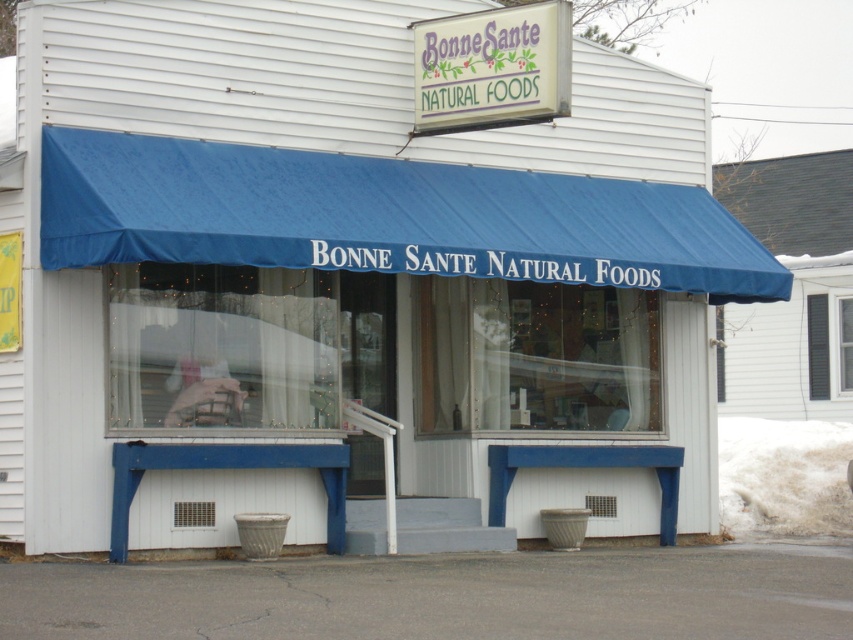
Is transparent plastic window at center bigger than black wood window at upper right?

Yes.

Who is lower down, transparent plastic window at center or black wood window at upper right?

Positioned lower is black wood window at upper right.

Who is more distant from viewer, (294, 289) or (819, 397)?

The point (819, 397) is more distant.

At what (x,y) coordinates should I click in order to perform the action: click on transparent plastic window at center. Please return your answer as a coordinate pair (x, y). Looking at the image, I should click on (247, 346).

Is blue fabric canopy at center to the right of black wood window at upper right from the viewer's perspective?

Incorrect, blue fabric canopy at center is not on the right side of black wood window at upper right.

Can you confirm if blue fabric canopy at center is taller than black wood window at upper right?

Incorrect, blue fabric canopy at center's height is not larger of black wood window at upper right's.

Is point (155, 221) more distant than point (846, 390)?

That is False.

Locate an element on the screen. blue fabric canopy at center is located at coordinates (384, 218).

Who is positioned more to the left, transparent plastic window at center or matte plastic sign at upper center?

transparent plastic window at center is more to the left.

Who is shorter, transparent plastic window at center or matte plastic sign at upper center?

matte plastic sign at upper center

Where is `transparent plastic window at center`? This screenshot has width=853, height=640. transparent plastic window at center is located at coordinates (247, 346).